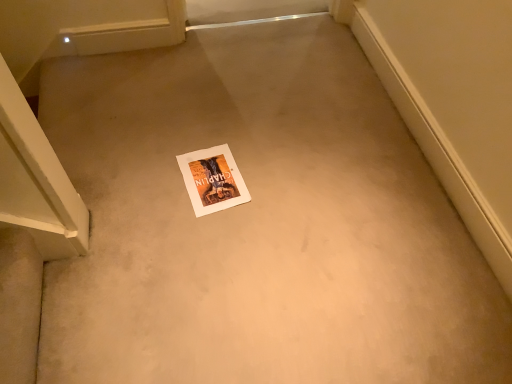
You are a GUI agent. You are given a task and a screenshot of the screen. Output one action in this format:
    pyautogui.click(x=<x>, y=<y>)
    Task: Click on the vacant area on the back side of carpeted stairs at lower left
    
    Given the screenshot: What is the action you would take?
    pyautogui.click(x=97, y=228)